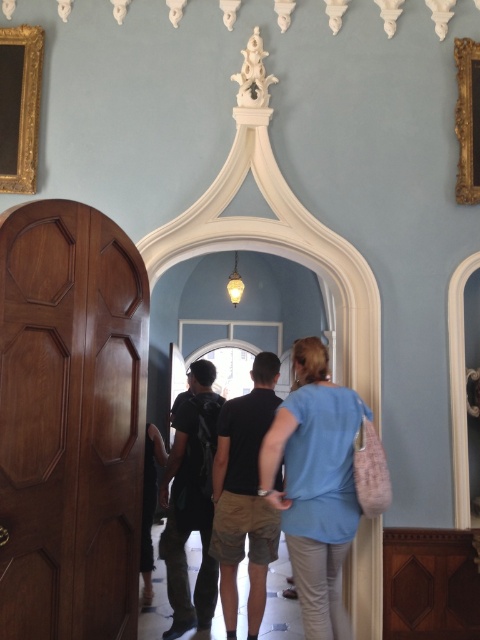
You are an interior designer assessing the placement of the gold ornate frame at upper left and the gold wood picture frame at right. Based on their sizes, which one would you recommend hanging higher on the wall to maintain visual balance?

The gold ornate frame at upper left has a greater height compared to the gold wood picture frame at right, so to maintain visual balance, the taller gold ornate frame at upper left should be hung higher on the wall.

You are an interior designer assessing the placement of items in the room. The black cotton shirt at center and the gold ornate frame at upper left are both in view. Which object has a greater height?

The black cotton shirt at center is taller than the gold ornate frame at upper left according to the description.

You are an interior designer planning to place a new painting in this historic building. You have two options for frames from the scene, the gold ornate frame at upper left and the gold wood picture frame at right. Which frame would you choose if you want the frame to be bigger?

The gold ornate frame at upper left is larger in size than the gold wood picture frame at right, so you should choose the gold ornate frame at upper left for a bigger frame.